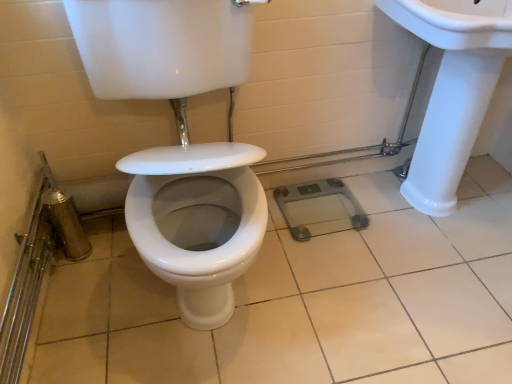
I want to click on white glossy tile at center, so click(306, 301).

Measure the distance between white glossy tile at center and camera.

3.80 feet.

Image resolution: width=512 pixels, height=384 pixels. What do you see at coordinates (306, 301) in the screenshot?
I see `white glossy tile at center` at bounding box center [306, 301].

What do you see at coordinates (452, 89) in the screenshot?
I see `white glossy sink at upper right` at bounding box center [452, 89].

Measure the distance between point (426, 176) and camera.

Point (426, 176) and camera are 5.31 feet apart.

Identify the location of white glossy sink at upper right. (452, 89).

Identify the location of white glossy tile at center. The image size is (512, 384). (306, 301).

Is white glossy tile at center to the left or to the right of white glossy sink at upper right in the image?

Clearly, white glossy tile at center is on the left of white glossy sink at upper right in the image.

In the scene shown: Which object is closer to the camera, white glossy tile at center or white glossy sink at upper right?

Positioned in front is white glossy tile at center.

Does point (318, 316) come in front of point (493, 9)?

That is False.

From the image's perspective, is white glossy tile at center beneath white glossy sink at upper right?

Correct, white glossy tile at center appears lower than white glossy sink at upper right in the image.

Consider the image. From a real-world perspective, is white glossy tile at center over white glossy sink at upper right?

Incorrect, from a real-world perspective, white glossy tile at center is lower than white glossy sink at upper right.

Which of these two, white glossy tile at center or white glossy sink at upper right, is wider?

With larger width is white glossy tile at center.

Who is shorter, white glossy tile at center or white glossy sink at upper right?

white glossy tile at center.

In the scene shown: Between white glossy tile at center and white glossy sink at upper right, which one has smaller size?

With smaller size is white glossy tile at center.

Is white glossy tile at center not within white glossy sink at upper right?

Yes, white glossy tile at center is not within white glossy sink at upper right.

Based on the photo, is white glossy tile at center directly adjacent to white glossy sink at upper right?

No, white glossy tile at center is not next to white glossy sink at upper right.

Does white glossy tile at center turn towards white glossy sink at upper right?

No, white glossy tile at center is not aimed at white glossy sink at upper right.

This screenshot has height=384, width=512. What are the coordinates of `sink to the right of white glossy tile at center` in the screenshot? It's located at (452, 89).

From the picture: Is white glossy sink at upper right to the left or to the right of white glossy tile at center in the image?

Clearly, white glossy sink at upper right is on the right of white glossy tile at center in the image.

Based on the photo, which object is closer to the camera taking this photo, white glossy sink at upper right or white glossy tile at center?

white glossy tile at center is more forward.

Which point is more forward, (487, 89) or (160, 382)?

Point (160, 382)

From the image's perspective, is white glossy sink at upper right positioned above or below white glossy tile at center?

Clearly, from the image's perspective, white glossy sink at upper right is above white glossy tile at center.

From a real-world perspective, is white glossy sink at upper right physically located above or below white glossy tile at center?

white glossy sink at upper right is situated higher than white glossy tile at center in the real world.

Considering the sizes of white glossy sink at upper right and white glossy tile at center in the image, is white glossy sink at upper right wider or thinner than white glossy tile at center?

In the image, white glossy sink at upper right appears to be more narrow than white glossy tile at center.

Can you confirm if white glossy sink at upper right is shorter than white glossy tile at center?

No, white glossy sink at upper right is not shorter than white glossy tile at center.

Which of these two, white glossy sink at upper right or white glossy tile at center, is smaller?

white glossy tile at center is smaller.

Is white glossy sink at upper right completely or partially outside of white glossy tile at center?

white glossy sink at upper right is positioned outside white glossy tile at center.

Is white glossy sink at upper right with white glossy tile at center?

No, white glossy sink at upper right is not beside white glossy tile at center.

Looking at this image, is white glossy sink at upper right positioned with its back to white glossy tile at center?

white glossy sink at upper right is not turned away from white glossy tile at center.

What's the angular difference between white glossy sink at upper right and white glossy tile at center's facing directions?

89.9 degrees separate the facing orientations of white glossy sink at upper right and white glossy tile at center.

This screenshot has height=384, width=512. I want to click on sink above the white glossy tile at center (from a real-world perspective), so click(452, 89).

Where is `sink above the white glossy tile at center (from a real-world perspective)`? This screenshot has height=384, width=512. sink above the white glossy tile at center (from a real-world perspective) is located at coordinates coord(452,89).

Locate an element on the screen. This screenshot has width=512, height=384. ceramic tile in front of the white glossy sink at upper right is located at coordinates coord(306,301).